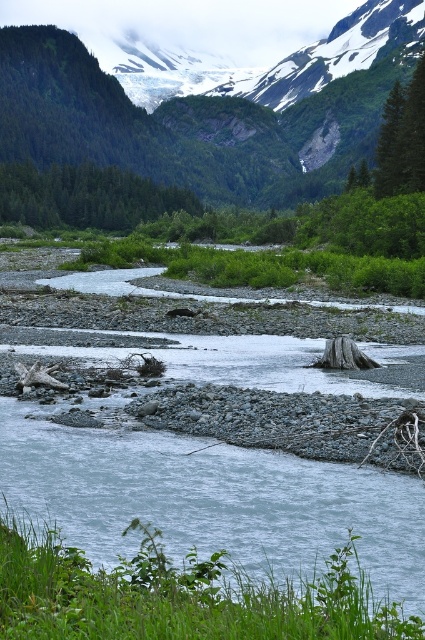
Can you confirm if green matte tree at center is shorter than green textured tree at upper right?

Correct, green matte tree at center is not as tall as green textured tree at upper right.

Which is above, green matte tree at center or green textured tree at upper right?

green matte tree at center is above.

Is point (25, 218) more distant than point (413, 118)?

That is True.

Find the location of a particular element. This screenshot has width=425, height=640. green matte tree at center is located at coordinates (85, 196).

Can you confirm if green forested mountain at upper center is shorter than green matte tree at center?

Incorrect, green forested mountain at upper center's height does not fall short of green matte tree at center's.

What do you see at coordinates (210, 108) in the screenshot? Image resolution: width=425 pixels, height=640 pixels. I see `green forested mountain at upper center` at bounding box center [210, 108].

Is point (297, 161) closer to camera compared to point (96, 179)?

No, it is behind (96, 179).

The height and width of the screenshot is (640, 425). Identify the location of green forested mountain at upper center. (210, 108).

Between green forested mountain at upper center and green textured tree at upper right, which one has less height?

With less height is green textured tree at upper right.

Which is in front, point (88, 140) or point (390, 156)?

Point (390, 156)

Which is behind, point (195, 102) or point (401, 124)?

Positioned behind is point (195, 102).

You are a GUI agent. You are given a task and a screenshot of the screen. Output one action in this format:
    pyautogui.click(x=<x>, y=<y>)
    Task: Click on the green forested mountain at upper center
    The height and width of the screenshot is (640, 425).
    Given the screenshot: What is the action you would take?
    pyautogui.click(x=210, y=108)